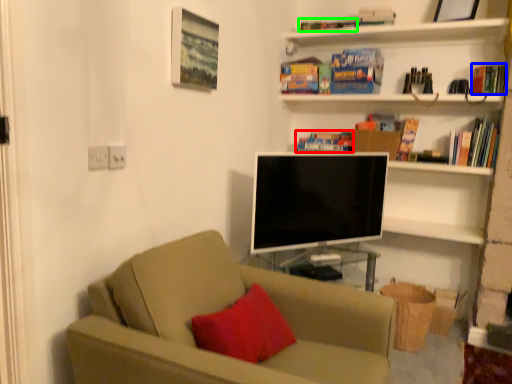
Question: Which is farther away from book (highlighted by a red box)? book (highlighted by a blue box) or book (highlighted by a green box)?

Choices:
 (A) book
 (B) book

Answer: (A)